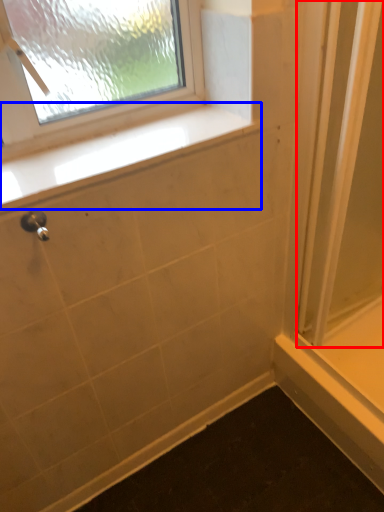
Question: Which point is further to the camera, screen door (highlighted by a red box) or window sill (highlighted by a blue box)?

Choices:
 (A) screen door
 (B) window sill

Answer: (A)